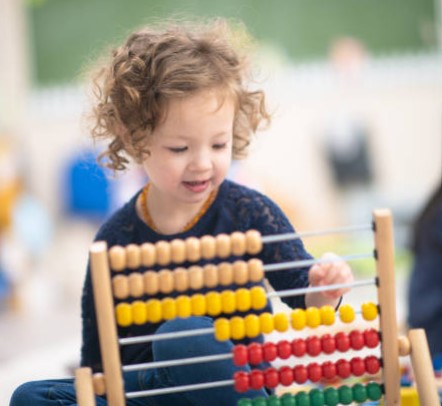
Find the location of a particular element. Image resolution: width=442 pixels, height=406 pixels. abacus bead in sixth row down is located at coordinates (240, 383), (254, 380), (270, 376), (288, 375), (302, 372), (317, 372), (331, 370), (346, 368), (361, 366), (373, 364).